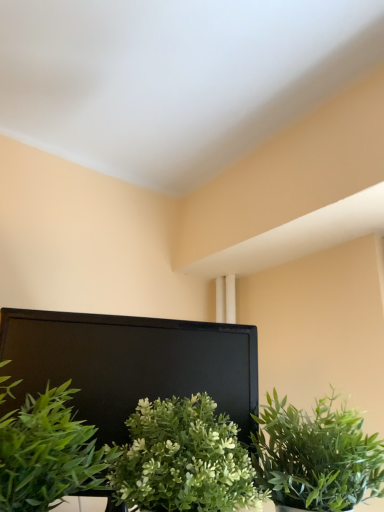
Question: From a real-world perspective, relative to green matte plant at center, the second houseplant in the left-to-right sequence, is green leafy plant at center, which is the 3th houseplant from left to right, vertically above or below?

Choices:
 (A) above
 (B) below

Answer: (A)

Question: Considering the relative positions of green leafy plant at center, which is the 3th houseplant from left to right, and green matte plant at center, the second houseplant viewed from the right, in the image provided, is green leafy plant at center, which is the 3th houseplant from left to right, to the left or to the right of green matte plant at center, the second houseplant viewed from the right,?

Choices:
 (A) left
 (B) right

Answer: (B)

Question: Which is farther from the green matte plant at center, the second houseplant in the left-to-right sequence?

Choices:
 (A) green leafy plant at center, which is the 3th houseplant from left to right
 (B) green leafy plant at lower left, the 1th houseplant positioned from the left

Answer: (A)

Question: Which of these objects is positioned farthest from the green leafy plant at center, the 1th houseplant when ordered from right to left?

Choices:
 (A) green matte plant at center, the second houseplant viewed from the right
 (B) green leafy plant at lower left, the 1th houseplant positioned from the left

Answer: (B)